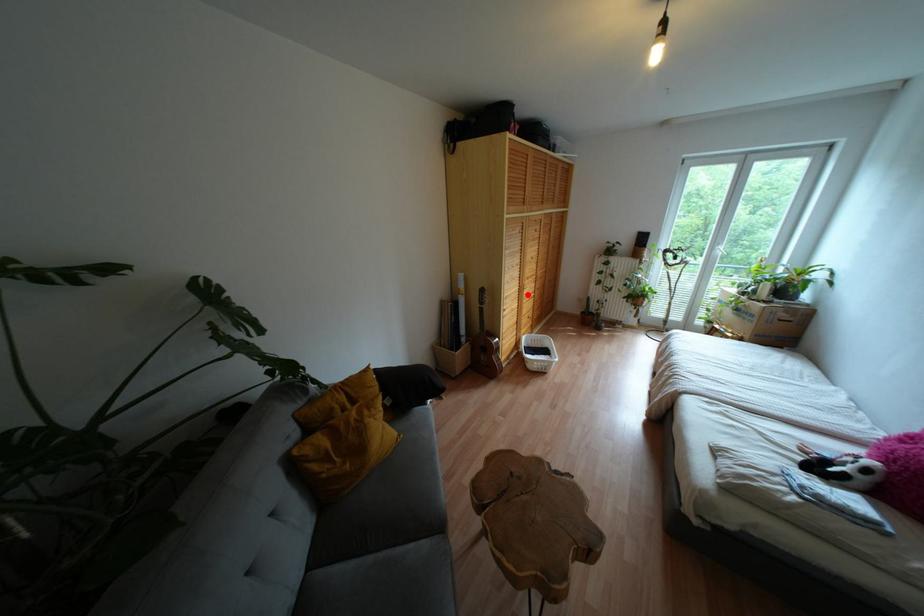
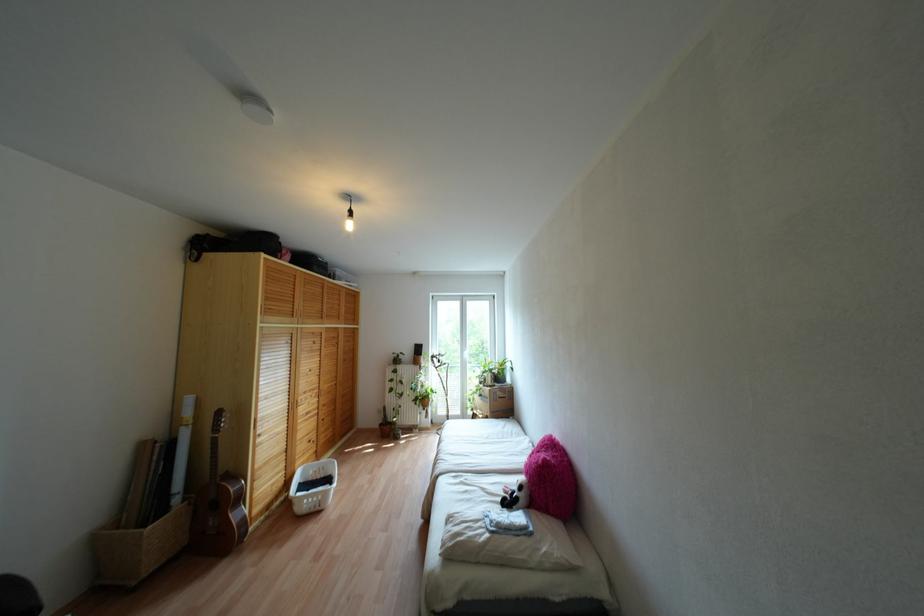
Where in the second image is the point corresponding to the highlighted location from the first image?

(307, 413)